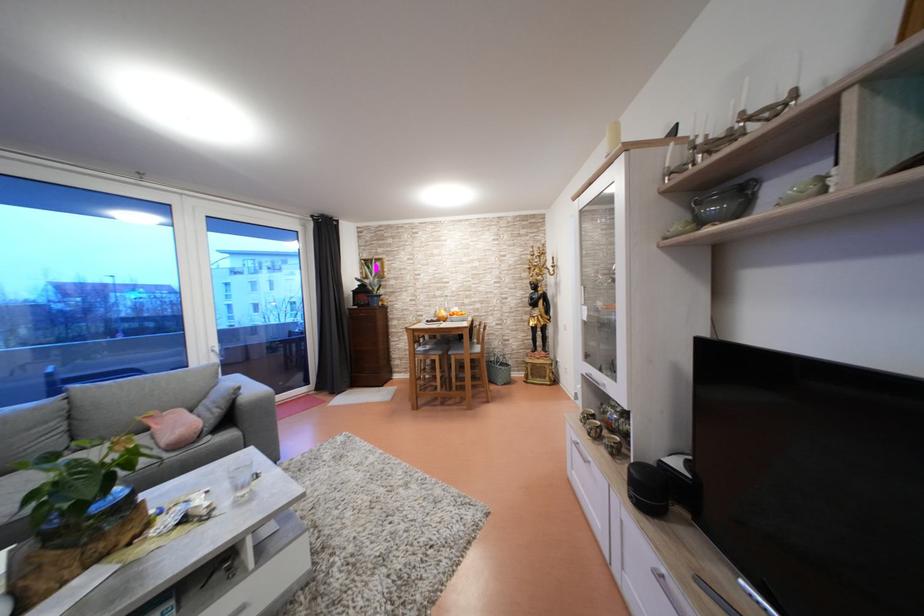
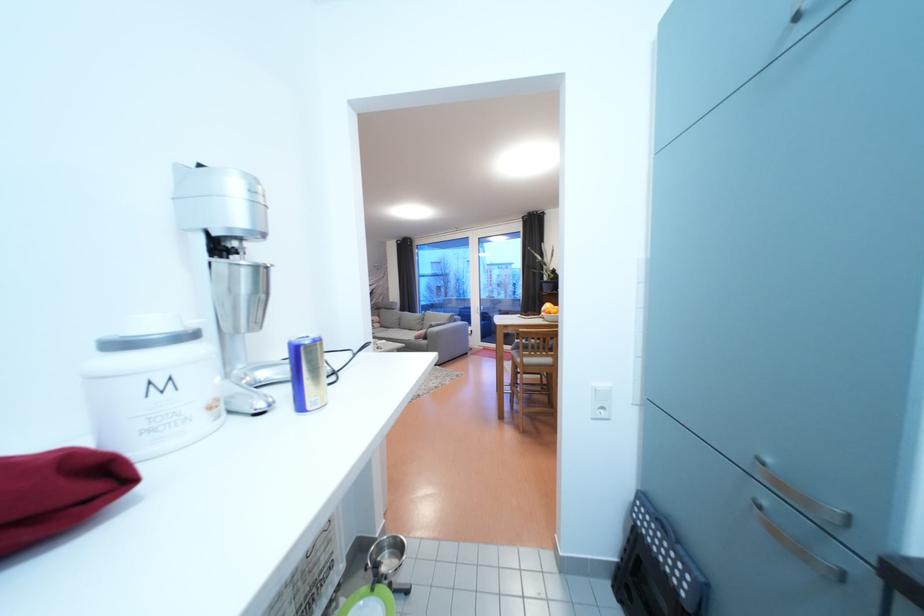
Question: I am providing you with two images of the same scene from different viewpoints. After the viewpoint changes to image2, which objects are now occluded?

Choices:
 (A) chair sitting surface
 (B) striped sofa surface
 (C) orange fruit
 (D) sofa sitting surface

Answer: (A)